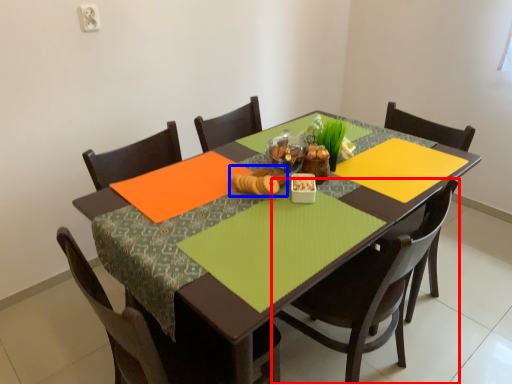
Question: Among these objects, which one is farthest to the camera, chair (highlighted by a red box) or food (highlighted by a blue box)?

Choices:
 (A) chair
 (B) food

Answer: (B)